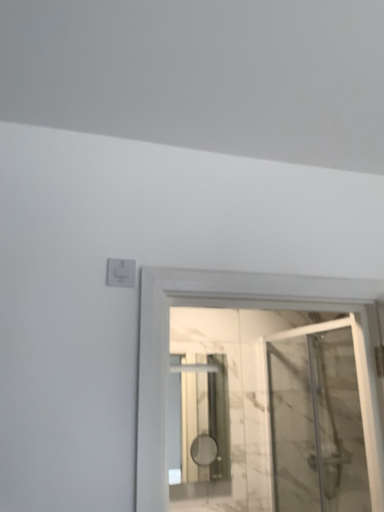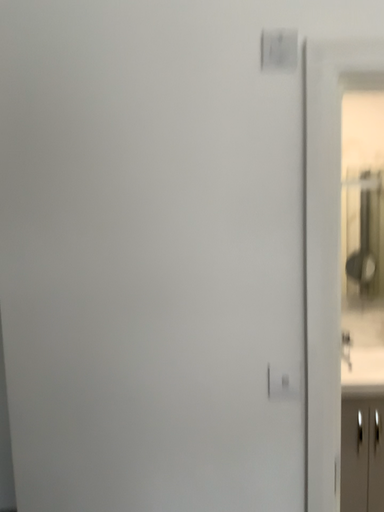
Question: Which way did the camera rotate in the video?

Choices:
 (A) rotated left
 (B) rotated right

Answer: (A)